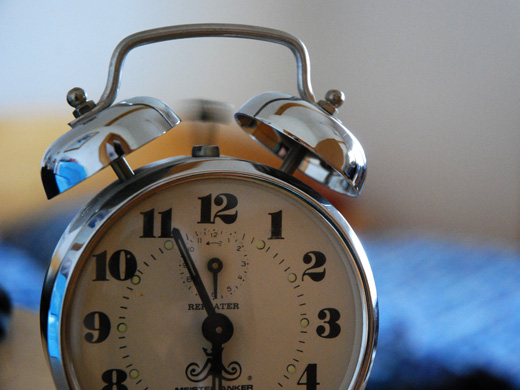
In order to click on bells on top of clock in this screenshot , I will do `click(320, 135)`, `click(112, 130)`.